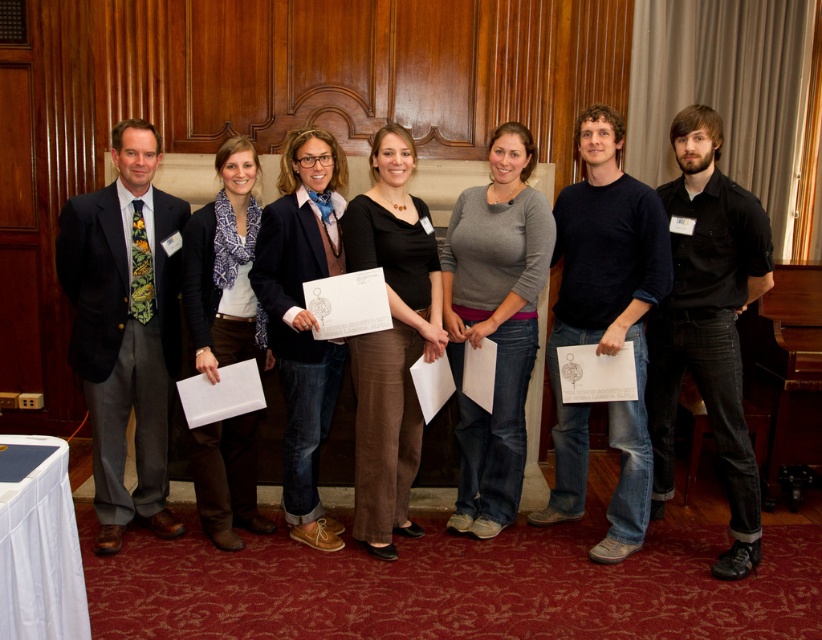
You are standing at the entrance of the room and see two points marked in the image. The first point is at coordinates point (636, 253) and the second point is at point (496, 522). Which point is closer to you?

Point (636, 253) is in front of point (496, 522), so it is closer to you.

You are organizing a photo shoot and need to arrange the dark gray suit at left and the black cotton shirt at right in a row. Based on the scene description, which should be placed first from your perspective?

The dark gray suit at left should be placed first from your perspective since it is positioned on the left side of the black cotton shirt at right.

You are a photographer standing at the back of the room. You need to take a photo that includes both the matte black jacket at center and the brown suede boots at lower left. The camera you are using has a maximum focus range of 10 inches. Can you capture both subjects in focus without moving closer?

The distance between the matte black jacket at center and the brown suede boots at lower left is 9.50 inches, which is within the camera maximum focus range of 10 inches. Therefore, you can capture both subjects in focus without moving closer.